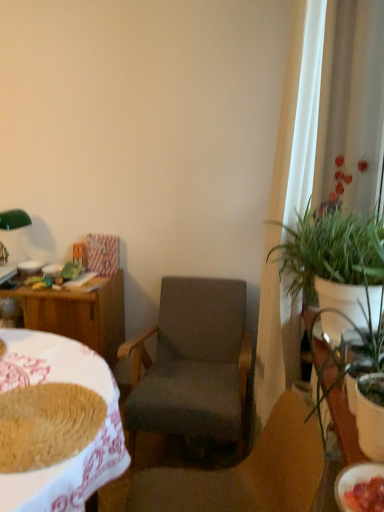
Find the location of a particular element. dark gray fabric chair at center, which ranks as the 2th chair in front-to-back order is located at coordinates (192, 364).

The image size is (384, 512). Identify the location of wooden table at left, arranged as the second table when viewed from the right. (78, 314).

In order to face baked brown bread at lower left, should I rotate leftwards or rightwards?

Turn left approximately 20.133 degrees to face it.

Measure the distance between wooden desk at left and camera.

wooden desk at left is 32.20 inches away from camera.

This screenshot has height=512, width=384. In order to click on white glossy bowl at left, which appears as the 1th bowl when viewed from the back in this screenshot , I will do `click(30, 267)`.

Is point (341, 502) positioned before point (100, 386)?

Yes, point (341, 502) is in front of point (100, 386).

Measure the distance from matte white bowl at lower right, the second bowl viewed from the left, to wooden desk at left.

They are 30.88 inches apart.

From the image's perspective, which bowl is the 1st one above the wooden desk at left? Please provide its 2D coordinates.

[(354, 480)]

Considering the relative positions of matte white bowl at lower right, marked as the second bowl in a top-to-bottom arrangement, and wooden desk at left in the image provided, is matte white bowl at lower right, marked as the second bowl in a top-to-bottom arrangement, to the right of wooden desk at left from the viewer's perspective?

Yes.

You are a GUI agent. You are given a task and a screenshot of the screen. Output one action in this format:
    pyautogui.click(x=<x>, y=<y>)
    Task: Click on the food to the left of white sheer curtain at right
    
    Given the screenshot: What is the action you would take?
    pyautogui.click(x=47, y=424)

Is baked brown bread at lower left not close to white sheer curtain at right?

Yes, baked brown bread at lower left and white sheer curtain at right are located far from each other.

From the picture: From their relative heights in the image, would you say baked brown bread at lower left is taller or shorter than white sheer curtain at right?

Clearly, baked brown bread at lower left is shorter compared to white sheer curtain at right.

Between baked brown bread at lower left and white sheer curtain at right, which one is positioned behind?

white sheer curtain at right is further from the camera.

From the image's perspective, which one is positioned lower, white sheer curtain at right or white glossy bowl at left, placed as the second bowl when sorted from right to left?

white glossy bowl at left, placed as the second bowl when sorted from right to left, is shown below in the image.

Can you see white sheer curtain at right touching white glossy bowl at left, which appears as the 1th bowl when viewed from the back?

No.

Consider the image. Can you confirm if white sheer curtain at right is wider than white glossy bowl at left, which is the second bowl from front to back?

Indeed, white sheer curtain at right has a greater width compared to white glossy bowl at left, which is the second bowl from front to back.

Do you think wooden table at left, acting as the 1th table starting from the left, is within wooden desk at left, or outside of it?

wooden table at left, acting as the 1th table starting from the left, is outside wooden desk at left.

Considering the sizes of wooden table at left, the second table positioned from the front, and wooden desk at left in the image, is wooden table at left, the second table positioned from the front, wider or thinner than wooden desk at left?

In the image, wooden table at left, the second table positioned from the front, appears to be more narrow than wooden desk at left.

From a real-world perspective, between wooden table at left, the second table positioned from the front, and wooden desk at left, who is vertically lower?

wooden table at left, the second table positioned from the front, from a real-world perspective.

Considering the relative positions of wooden table at left, the second table positioned from the front, and wooden desk at left in the image provided, is wooden table at left, the second table positioned from the front, to the right of wooden desk at left from the viewer's perspective?

No.

Is white glossy table at right, placed as the 2th table when sorted from left to right, far from green leafy plant at right?

No, white glossy table at right, placed as the 2th table when sorted from left to right, is not far from green leafy plant at right.

Can you tell me how much white glossy table at right, the 1th table positioned from the right, and green leafy plant at right differ in facing direction?

The facing directions of white glossy table at right, the 1th table positioned from the right, and green leafy plant at right are 0.705 degrees apart.

Considering the positions of points (348, 437) and (287, 272), is point (348, 437) farther from camera compared to point (287, 272)?

That is False.

From a real-world perspective, which is physically above, white glossy table at right, the 1th table positioned from the right, or green leafy plant at right?

From a 3D spatial view, green leafy plant at right is above.

Which object is positioned more to the right, matte white bowl at lower right, marked as the second bowl in a top-to-bottom arrangement, or dark gray fabric chair at center, which ranks as the 1th chair in front-to-back order?

matte white bowl at lower right, marked as the second bowl in a top-to-bottom arrangement, is more to the right.

From a real-world perspective, does matte white bowl at lower right, the first bowl ordered from the bottom, stand above dark gray fabric chair at center, the 2th chair when ordered from back to front?

Yes, from a real-world perspective, matte white bowl at lower right, the first bowl ordered from the bottom, is on top of dark gray fabric chair at center, the 2th chair when ordered from back to front.

Does matte white bowl at lower right, the first bowl ordered from the bottom, have a greater width compared to dark gray fabric chair at center, the 2th chair when ordered from back to front?

No, matte white bowl at lower right, the first bowl ordered from the bottom, is not wider than dark gray fabric chair at center, the 2th chair when ordered from back to front.

Is point (356, 466) in front of point (286, 391)?

Yes.

In the scene shown: Measure the distance from green leafy plant at right to white glossy table at right, the second table in the back-to-front sequence.

6.50 inches.

From a real-world perspective, which is physically above, green leafy plant at right or white glossy table at right, placed as the 2th table when sorted from left to right?

green leafy plant at right.

Is there a large distance between green leafy plant at right and white glossy table at right, placed as the 2th table when sorted from left to right?

Actually, green leafy plant at right and white glossy table at right, placed as the 2th table when sorted from left to right, are a little close together.

Which is in front, green leafy plant at right or white glossy table at right, which is the 1th table from front to back?

Positioned in front is white glossy table at right, which is the 1th table from front to back.

Locate an element on the screen. The height and width of the screenshot is (512, 384). desk below the matte white bowl at lower right, marked as the second bowl in a top-to-bottom arrangement (from a real-world perspective) is located at coordinates (81, 451).

Find the location of a particular element. curtain on the right of baked brown bread at lower left is located at coordinates (299, 114).

When comparing their distances from green leafy plant at right, does wooden desk at left or dark gray fabric chair at center, placed as the 1th chair when sorted from back to front, seem further?

wooden desk at left is positioned further to the anchor green leafy plant at right.

Looking at the image, which one is located further to white glossy bowl at left, the 1th bowl viewed from the left, wooden desk at left or white glossy table at right, the second table in the back-to-front sequence?

The object further to white glossy bowl at left, the 1th bowl viewed from the left, is white glossy table at right, the second table in the back-to-front sequence.

Considering their positions, is white glossy bowl at left, which is counted as the first bowl, starting from the top, positioned closer to wooden table at left, which is counted as the 1th table, starting from the back, than dark gray fabric chair at center, the 2th chair when ordered from back to front?

white glossy bowl at left, which is counted as the first bowl, starting from the top, is closer to wooden table at left, which is counted as the 1th table, starting from the back.

Which object lies further to the anchor point wooden desk at left, green leafy plant at right or baked brown bread at lower left?

green leafy plant at right lies further to wooden desk at left than the other object.

Considering their positions, is wooden desk at left positioned closer to matte white bowl at lower right, the second bowl positioned from the back, than wooden table at left, which is counted as the 1th table, starting from the back?

wooden desk at left.

Estimate the real-world distances between objects in this image. Which object is closer to matte white bowl at lower right, the first bowl ordered from the bottom, dark gray fabric chair at center, the 2th chair when ordered from back to front, or white glossy bowl at left, which appears as the 1th bowl when viewed from the back?

dark gray fabric chair at center, the 2th chair when ordered from back to front, is closer to matte white bowl at lower right, the first bowl ordered from the bottom.

Based on their spatial positions, is green leafy plant at right or dark gray fabric chair at center, placed as the 1th chair when sorted from back to front, further from dark gray fabric chair at center, the 2th chair when ordered from back to front?

dark gray fabric chair at center, placed as the 1th chair when sorted from back to front, is positioned further to the anchor dark gray fabric chair at center, the 2th chair when ordered from back to front.

Based on their spatial positions, is dark gray fabric chair at center, the 2th chair when ordered from back to front, or wooden table at left, arranged as the second table when viewed from the right, closer to white glossy table at right, which is the 1th table from front to back?

Based on the image, dark gray fabric chair at center, the 2th chair when ordered from back to front, appears to be nearer to white glossy table at right, which is the 1th table from front to back.

I want to click on houseplant between matte white bowl at lower right, the first bowl ordered from the bottom, and white glossy bowl at left, which is the second bowl from front to back, in the front-back direction, so click(338, 263).

Image resolution: width=384 pixels, height=512 pixels. I want to click on desk positioned between matte white bowl at lower right, positioned as the first bowl in front-to-back order, and white glossy bowl at left, placed as the second bowl when sorted from right to left, from near to far, so click(x=81, y=451).

The height and width of the screenshot is (512, 384). What are the coordinates of `food between wooden desk at left and dark gray fabric chair at center, placed as the 1th chair when sorted from back to front, along the z-axis` in the screenshot? It's located at (47, 424).

Locate an element on the screen. curtain between baked brown bread at lower left and white glossy table at right, the 1th table positioned from the right is located at coordinates (299, 114).